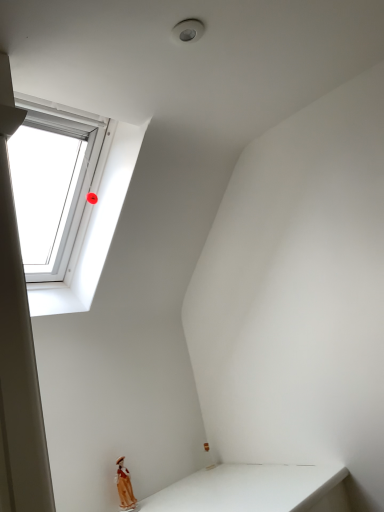
Question: Should I look upward or downward to see white plastic window at upper left?

Choices:
 (A) down
 (B) up

Answer: (B)